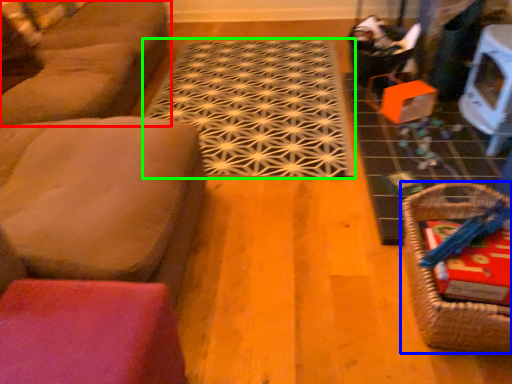
Question: Considering the real-world distances, which object is closest to studio couch (highlighted by a red box)? basket (highlighted by a blue box) or doormat (highlighted by a green box).

Choices:
 (A) basket
 (B) doormat

Answer: (B)